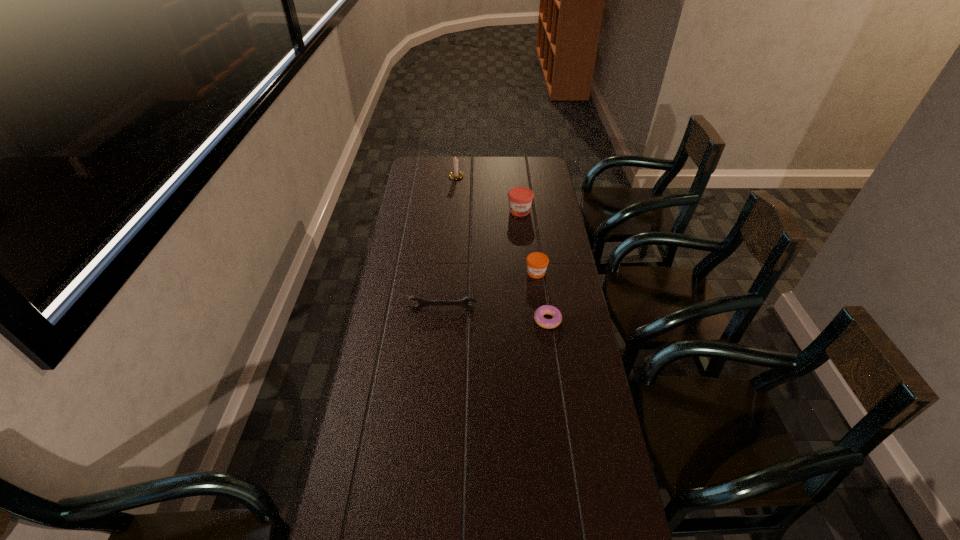
Find the location of `object that stands as the closest to the nearer jam`. object that stands as the closest to the nearer jam is located at coordinates (x=545, y=309).

Find the location of a particular element. The width and height of the screenshot is (960, 540). free location that satisfies the following two spatial constraints: 1. on the front label of the doughnut; 2. on the left side of the nearer jam is located at coordinates (542, 320).

At what (x,y) coordinates should I click in order to perform the action: click on free space that satisfies the following two spatial constraints: 1. on the open ends of the wrench; 2. on the left side of the shortest object. Please return your answer as a coordinate pair (x, y). The image size is (960, 540). Looking at the image, I should click on (442, 320).